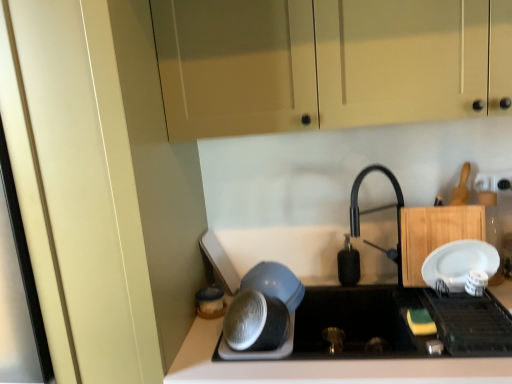
The image size is (512, 384). Identify the location of vacant area that is in front of matte plastic container at lower center, marked as the first appliance in a left-to-right arrangement. (206, 340).